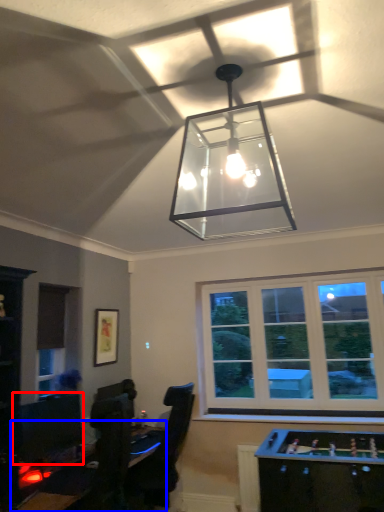
Question: Which of the following is the closest to the observer, computer monitor (highlighted by a red box) or table (highlighted by a blue box)?

Choices:
 (A) computer monitor
 (B) table

Answer: (B)